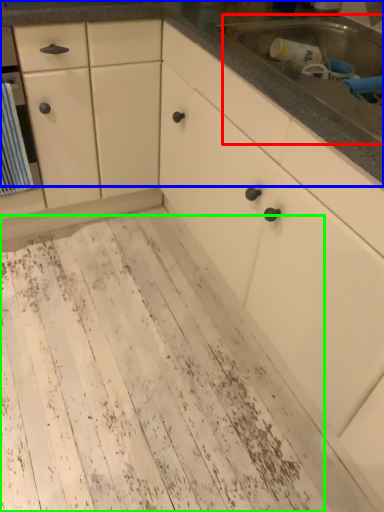
Question: Estimate the real-world distances between objects in this image. Which object is closer to sink (highlighted by a red box), countertop (highlighted by a blue box) or mud (highlighted by a green box)?

Choices:
 (A) countertop
 (B) mud

Answer: (A)